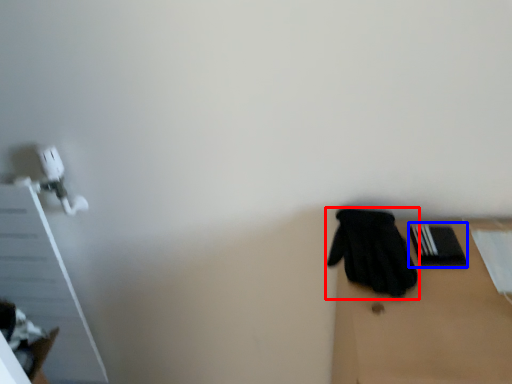
Question: Which object is further to the camera taking this photo, glove (highlighted by a red box) or bin (highlighted by a blue box)?

Choices:
 (A) glove
 (B) bin

Answer: (B)